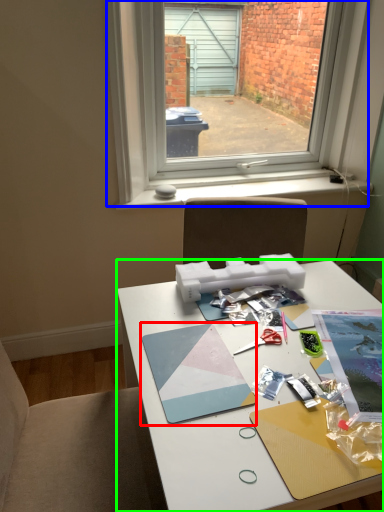
Question: Which object is positioned farthest from magazine (highlighted by a red box)? Select from window (highlighted by a blue box) and desk (highlighted by a green box).

Choices:
 (A) window
 (B) desk

Answer: (A)